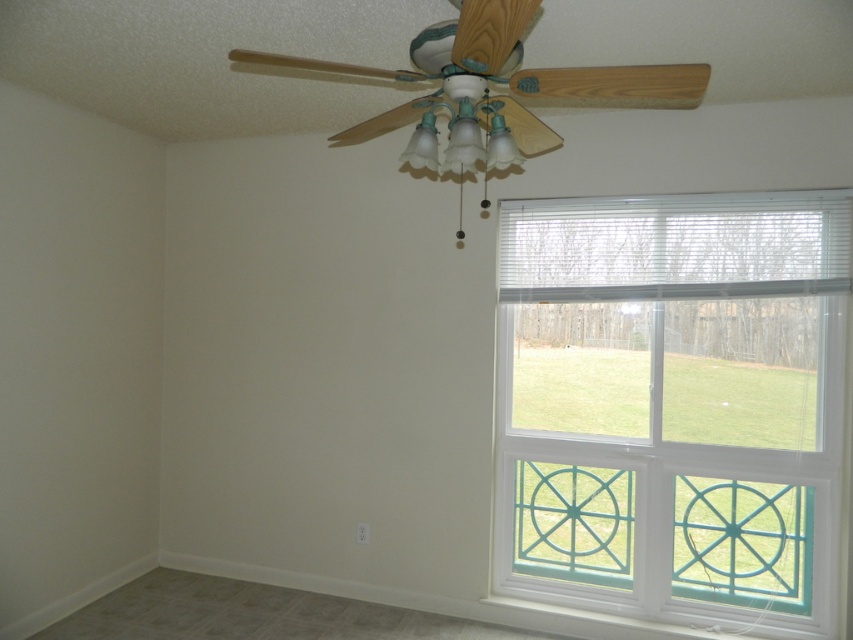
Can you confirm if white glass window at right is bigger than wooden ceiling fan at upper center?

Yes, white glass window at right is bigger than wooden ceiling fan at upper center.

Who is taller, white glass window at right or wooden ceiling fan at upper center?

white glass window at right is taller.

Who is more forward, (532, 240) or (689, 81)?

Positioned in front is point (689, 81).

Find the location of a particular element. The width and height of the screenshot is (853, 640). white glass window at right is located at coordinates (672, 403).